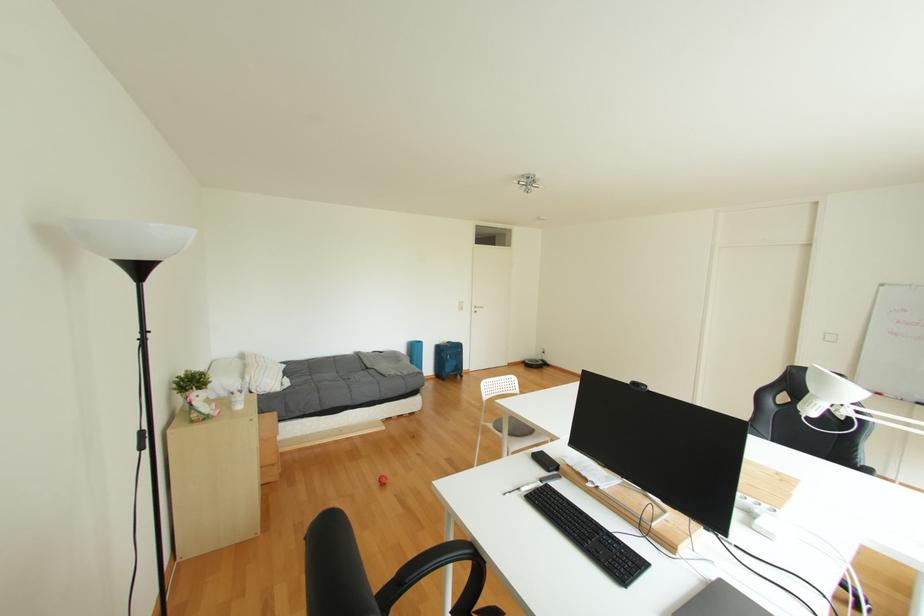
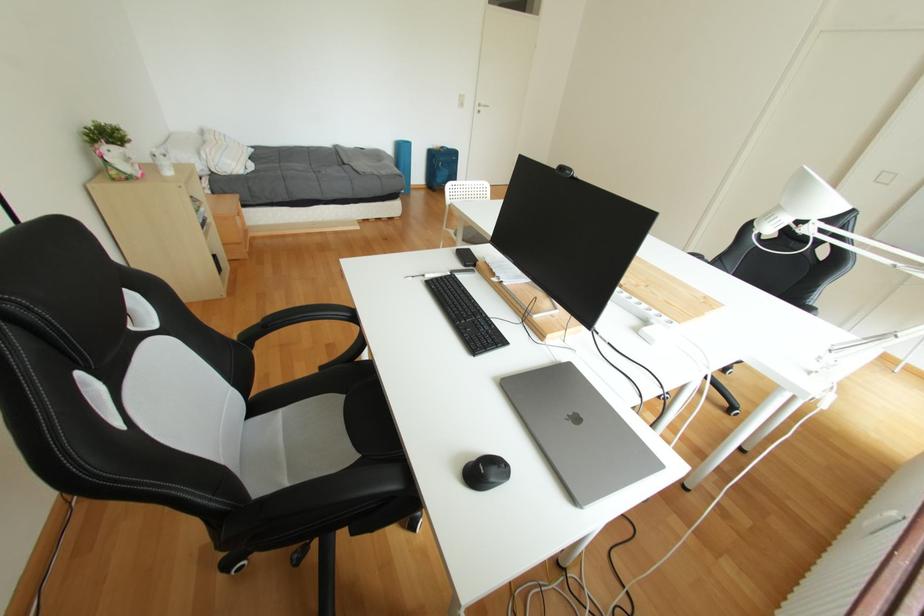
Question: How did the camera likely rotate?

Choices:
 (A) Left
 (B) Right
 (C) Up
 (D) Down

Answer: (D)